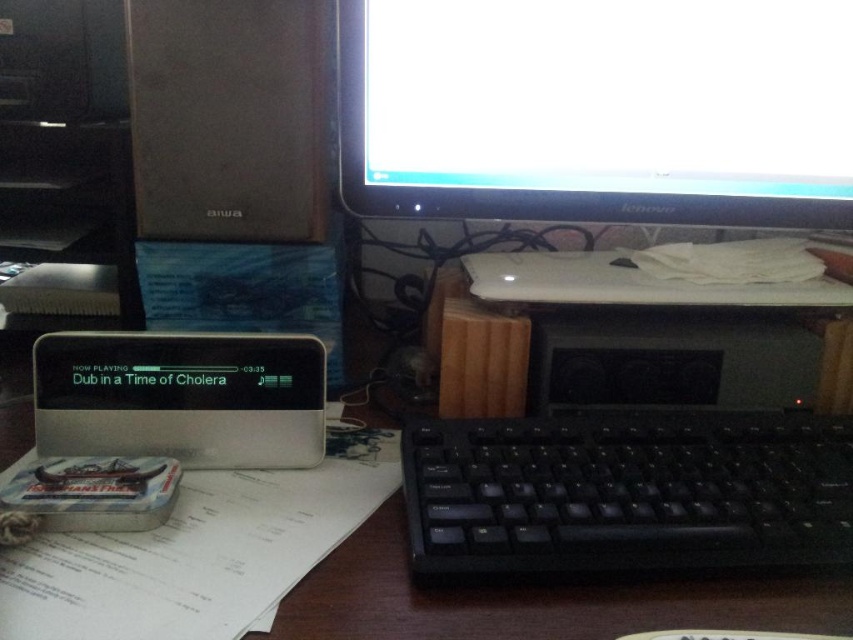
Is black glossy monitor at upper center bigger than silver/black plastic computer at center?

No, black glossy monitor at upper center is not bigger than silver/black plastic computer at center.

In the scene shown: Can you confirm if black glossy monitor at upper center is positioned to the left of silver/black plastic computer at center?

Incorrect, black glossy monitor at upper center is not on the left side of silver/black plastic computer at center.

Between point (590, 141) and point (320, 604), which one is positioned behind?

The point (590, 141) is behind.

I want to click on black glossy monitor at upper center, so click(596, 109).

Looking at this image, is black plastic keyboard at center closer to camera compared to silver/black plastic computer at center?

No, it is behind silver/black plastic computer at center.

Is black plastic keyboard at center below silver/black plastic computer at center?

Yes.

Identify the location of black plastic keyboard at center. (625, 493).

Can you confirm if black glossy monitor at upper center is thinner than black plastic keyboard at center?

In fact, black glossy monitor at upper center might be wider than black plastic keyboard at center.

Can you confirm if black glossy monitor at upper center is positioned to the left of black plastic keyboard at center?

Correct, you'll find black glossy monitor at upper center to the left of black plastic keyboard at center.

Who is more forward, (x=718, y=64) or (x=718, y=508)?

Point (x=718, y=508)

Find the location of a particular element. This screenshot has width=853, height=640. black glossy monitor at upper center is located at coordinates (596, 109).